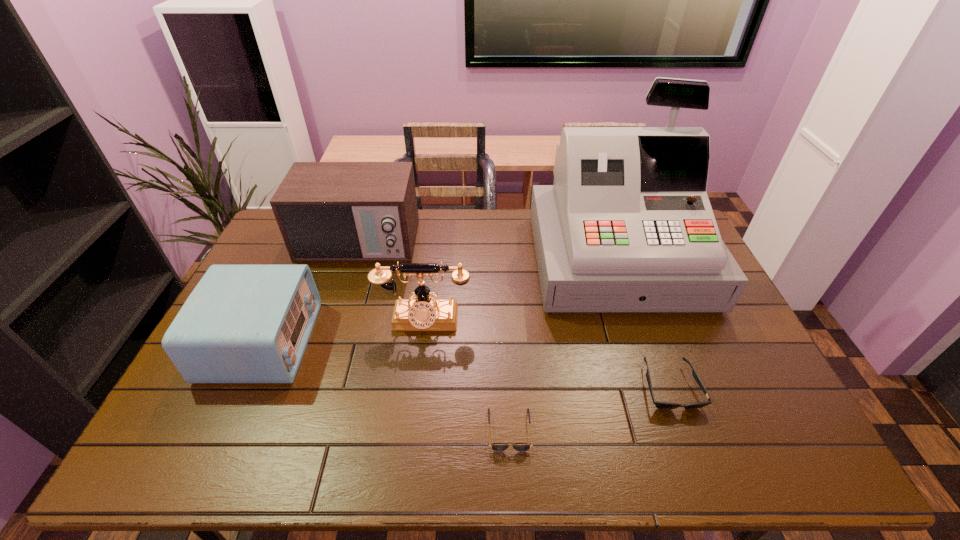
In order to click on the tallest object in this screenshot , I will do `click(627, 226)`.

You are a GUI agent. You are given a task and a screenshot of the screen. Output one action in this format:
    pyautogui.click(x=<x>, y=<y>)
    Task: Click on the farther radio receiver
    Image resolution: width=960 pixels, height=540 pixels.
    Given the screenshot: What is the action you would take?
    pyautogui.click(x=326, y=211)

Where is `telephone`? telephone is located at coordinates (422, 313).

Locate an element on the screen. The width and height of the screenshot is (960, 540). the shorter radio receiver is located at coordinates (242, 323).

Where is `the nearer radio receiver`? The width and height of the screenshot is (960, 540). the nearer radio receiver is located at coordinates (242, 323).

You are a GUI agent. You are given a task and a screenshot of the screen. Output one action in this format:
    pyautogui.click(x=<x>, y=<y>)
    Task: Click on the taller sunglasses
    Image resolution: width=960 pixels, height=540 pixels.
    Given the screenshot: What is the action you would take?
    pyautogui.click(x=660, y=405)

I want to click on the fifth tallest object, so click(x=660, y=405).

Image resolution: width=960 pixels, height=540 pixels. Identify the location of the left sunglasses. (496, 447).

I want to click on the shorter sunglasses, so click(496, 447).

Identify the location of vacant region located on the keypad side of the tallest object. The height and width of the screenshot is (540, 960). (654, 366).